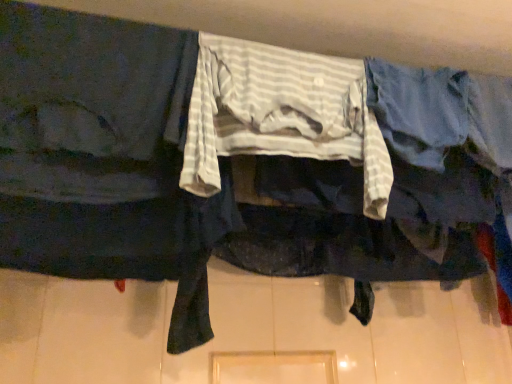
Question: Is dark blue fabric at left spatially inside white striped fabric at center, or outside of it?

Choices:
 (A) outside
 (B) inside

Answer: (A)

Question: Based on their positions, is dark blue fabric at left located to the left or right of white striped fabric at center?

Choices:
 (A) right
 (B) left

Answer: (B)

Question: Is dark blue fabric at left bigger or smaller than white striped fabric at center?

Choices:
 (A) small
 (B) big

Answer: (B)

Question: Is white striped fabric at center situated inside dark blue fabric at left or outside?

Choices:
 (A) outside
 (B) inside

Answer: (A)

Question: Based on their sizes in the image, would you say white striped fabric at center is bigger or smaller than dark blue fabric at left?

Choices:
 (A) small
 (B) big

Answer: (A)

Question: From the image's perspective, is white striped fabric at center above or below dark blue fabric at left?

Choices:
 (A) below
 (B) above

Answer: (B)

Question: From a real-world perspective, is white striped fabric at center positioned above or below dark blue fabric at left?

Choices:
 (A) above
 (B) below

Answer: (A)